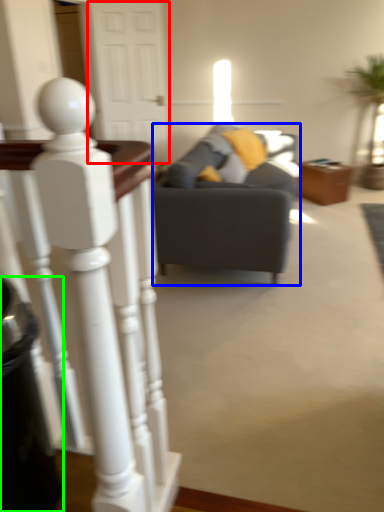
Question: Which object is positioned farthest from glass door (highlighted by a red box)? Select from studio couch (highlighted by a blue box) and trash bin/can (highlighted by a green box).

Choices:
 (A) studio couch
 (B) trash bin/can

Answer: (B)